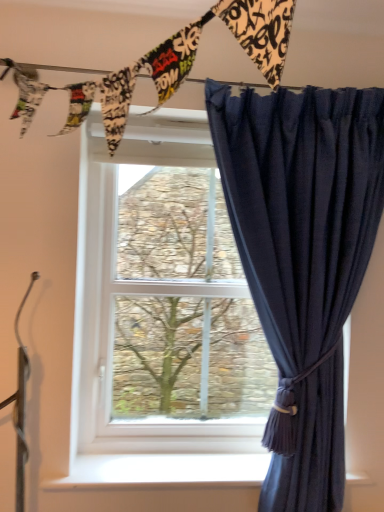
Measure the distance between navy blue sheer curtain at right and camera.

They are 4.15 feet apart.

This screenshot has height=512, width=384. What do you see at coordinates (302, 259) in the screenshot?
I see `navy blue sheer curtain at right` at bounding box center [302, 259].

Locate an element on the screen. navy blue sheer curtain at right is located at coordinates (302, 259).

From the image's perspective, between white plastic window at center and white smooth window sill at lower center, which one is located above?

white plastic window at center.

Would you say white plastic window at center is a long distance from white smooth window sill at lower center?

They are positioned close to each other.

Is white plastic window at center positioned in front of white smooth window sill at lower center?

No.

Considering the relative positions of white plastic window at center and white smooth window sill at lower center in the image provided, is white plastic window at center to the left or to the right of white smooth window sill at lower center?

From the image, it's evident that white plastic window at center is to the left of white smooth window sill at lower center.

Is white smooth window sill at lower center smaller than white plastic window at center?

Yes.

At what (x,y) coordinates should I click in order to perform the action: click on window sill below the white plastic window at center (from a real-world perspective). Please return your answer as a coordinate pair (x, y). The width and height of the screenshot is (384, 512). Looking at the image, I should click on (162, 471).

From the image's perspective, which one is positioned lower, white smooth window sill at lower center or white plastic window at center?

From the image's view, white smooth window sill at lower center is below.

From a real-world perspective, which object stands above the other?

In real-world perspective, navy blue sheer curtain at right is above.

Looking at the image, does navy blue sheer curtain at right seem bigger or smaller compared to white smooth window sill at lower center?

Clearly, navy blue sheer curtain at right is larger in size than white smooth window sill at lower center.

Which is less distant, (293, 317) or (229, 479)?

Point (293, 317) is closer to the camera than point (229, 479).

From the image's perspective, is white plastic window at center positioned above or below navy blue sheer curtain at right?

Clearly, from the image's perspective, white plastic window at center is above navy blue sheer curtain at right.

Does point (173, 425) come in front of point (249, 138)?

No, (173, 425) is further to viewer.

Is navy blue sheer curtain at right at the back of white plastic window at center?

No, white plastic window at center is not facing the opposite direction of navy blue sheer curtain at right.

Can you confirm if white plastic window at center is thinner than navy blue sheer curtain at right?

Correct, the width of white plastic window at center is less than that of navy blue sheer curtain at right.

Considering the relative sizes of white smooth window sill at lower center and navy blue sheer curtain at right in the image provided, is white smooth window sill at lower center shorter than navy blue sheer curtain at right?

Correct, white smooth window sill at lower center is not as tall as navy blue sheer curtain at right.

Looking at this image, is white smooth window sill at lower center not inside navy blue sheer curtain at right?

That's correct, white smooth window sill at lower center is outside of navy blue sheer curtain at right.

Which of these two, white smooth window sill at lower center or navy blue sheer curtain at right, is wider?

white smooth window sill at lower center is wider.

Consider the image. From a real-world perspective, is white smooth window sill at lower center positioned under navy blue sheer curtain at right based on gravity?

Correct, in the physical world, white smooth window sill at lower center is lower than navy blue sheer curtain at right.

In the scene shown: Is navy blue sheer curtain at right completely or partially outside of white plastic window at center?

Indeed, navy blue sheer curtain at right is completely outside white plastic window at center.

Looking at this image, does navy blue sheer curtain at right have a larger size compared to white plastic window at center?

Yes, navy blue sheer curtain at right is bigger than white plastic window at center.

Is white plastic window at center at the back of navy blue sheer curtain at right?

Yes.

Where is `window that appears on the left of navy blue sheer curtain at right`? The image size is (384, 512). window that appears on the left of navy blue sheer curtain at right is located at coordinates (164, 297).

At what (x,y) coordinates should I click in order to perform the action: click on window sill beneath the white plastic window at center (from a real-world perspective). Please return your answer as a coordinate pair (x, y). The image size is (384, 512). Looking at the image, I should click on coord(162,471).

At what (x,y) coordinates should I click in order to perform the action: click on window behind the white smooth window sill at lower center. Please return your answer as a coordinate pair (x, y). This screenshot has height=512, width=384. Looking at the image, I should click on (164, 297).

Which object lies nearer to the anchor point white smooth window sill at lower center, white plastic window at center or navy blue sheer curtain at right?

navy blue sheer curtain at right lies closer to white smooth window sill at lower center than the other object.

Estimate the real-world distances between objects in this image. Which object is closer to navy blue sheer curtain at right, white smooth window sill at lower center or white plastic window at center?

white plastic window at center lies closer to navy blue sheer curtain at right than the other object.

Looking at the image, which one is located further to navy blue sheer curtain at right, white plastic window at center or white smooth window sill at lower center?

white smooth window sill at lower center.

In the scene shown: From the image, which object appears to be nearer to white plastic window at center, navy blue sheer curtain at right or white smooth window sill at lower center?

The object closer to white plastic window at center is navy blue sheer curtain at right.

Based on their spatial positions, is white smooth window sill at lower center or navy blue sheer curtain at right closer to white plastic window at center?

navy blue sheer curtain at right is closer to white plastic window at center.

Looking at the image, which one is located closer to white smooth window sill at lower center, navy blue sheer curtain at right or white plastic window at center?

navy blue sheer curtain at right is positioned closer to the anchor white smooth window sill at lower center.

I want to click on curtain between white plastic window at center and white smooth window sill at lower center in the vertical direction, so click(x=302, y=259).